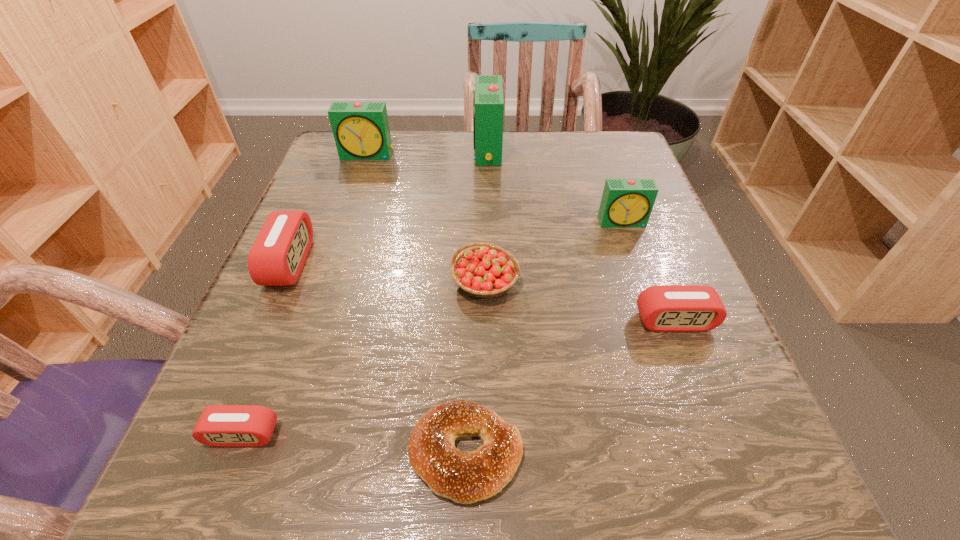
Identify the location of the rightmost pink alarm clock. (666, 308).

This screenshot has width=960, height=540. What are the coordinates of `the nearest pink alarm clock` in the screenshot? It's located at (220, 425).

The width and height of the screenshot is (960, 540). What are the coordinates of `the shortest alarm clock` in the screenshot? It's located at 220,425.

This screenshot has height=540, width=960. What are the coordinates of `bagel` in the screenshot? It's located at (465, 477).

The width and height of the screenshot is (960, 540). I want to click on vacant space located on the front-facing side of the third alarm clock from right to left, so click(x=346, y=150).

Locate an element on the screen. This screenshot has width=960, height=540. vacant space located 0.340m on the front-facing side of the third alarm clock from right to left is located at coordinates (329, 150).

Identify the location of free spot located on the front-facing side of the third alarm clock from right to left. (452, 150).

The width and height of the screenshot is (960, 540). I want to click on vacant region located on the front-facing side of the second biggest green alarm clock, so click(x=347, y=219).

Where is `vacant space located on the front-facing side of the nearest green alarm clock`? Image resolution: width=960 pixels, height=540 pixels. vacant space located on the front-facing side of the nearest green alarm clock is located at coordinates click(x=686, y=402).

At what (x,y) coordinates should I click in order to perform the action: click on vacant area situated on the left of the strawberry. Please return your answer as a coordinate pair (x, y). Image resolution: width=960 pixels, height=540 pixels. Looking at the image, I should click on [x=325, y=282].